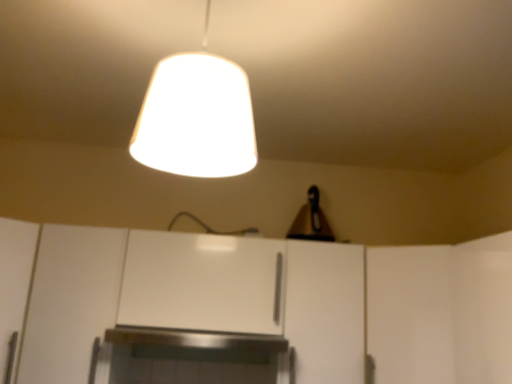
Question: From a real-world perspective, is white matte cabinet at lower left, placed as the 1th cabinetry when sorted from left to right, on top of white matte lampshade at upper center?

Choices:
 (A) no
 (B) yes

Answer: (A)

Question: From the image's perspective, would you say white matte cabinet at lower left, which is counted as the 3th cabinetry, starting from the right, is shown under white matte lampshade at upper center?

Choices:
 (A) yes
 (B) no

Answer: (A)

Question: Considering the relative positions of white matte cabinet at lower left, which is counted as the 3th cabinetry, starting from the right, and white matte lampshade at upper center in the image provided, is white matte cabinet at lower left, which is counted as the 3th cabinetry, starting from the right, to the right of white matte lampshade at upper center from the viewer's perspective?

Choices:
 (A) yes
 (B) no

Answer: (B)

Question: Considering the relative sizes of white matte cabinet at lower left, placed as the 1th cabinetry when sorted from left to right, and white matte lampshade at upper center in the image provided, is white matte cabinet at lower left, placed as the 1th cabinetry when sorted from left to right, smaller than white matte lampshade at upper center?

Choices:
 (A) yes
 (B) no

Answer: (B)

Question: Can you confirm if white matte cabinet at lower left, placed as the 1th cabinetry when sorted from left to right, is positioned to the left of white matte lampshade at upper center?

Choices:
 (A) no
 (B) yes

Answer: (B)

Question: Is white matte cabinet at center, which ranks as the third cabinetry in left-to-right order, in front of or behind white matte door at right in the image?

Choices:
 (A) behind
 (B) front

Answer: (A)

Question: Based on their positions, is white matte cabinet at center, which is counted as the first cabinetry, starting from the right, located to the left or right of white matte door at right?

Choices:
 (A) left
 (B) right

Answer: (A)

Question: From a real-world perspective, is white matte cabinet at center, which is counted as the first cabinetry, starting from the right, positioned above or below white matte door at right?

Choices:
 (A) above
 (B) below

Answer: (B)

Question: In terms of height, does white matte cabinet at center, which is counted as the first cabinetry, starting from the right, look taller or shorter compared to white matte door at right?

Choices:
 (A) short
 (B) tall

Answer: (B)

Question: From the image's perspective, relative to white matte lampshade at upper center, is white matte cabinet at center, which ranks as the 2th cabinetry in right-to-left order, above or below?

Choices:
 (A) below
 (B) above

Answer: (A)

Question: Is white matte cabinet at center, which ranks as the 2th cabinetry in right-to-left order, to the left or to the right of white matte lampshade at upper center in the image?

Choices:
 (A) right
 (B) left

Answer: (B)

Question: Is white matte cabinet at center, which ranks as the 2th cabinetry in right-to-left order, bigger or smaller than white matte lampshade at upper center?

Choices:
 (A) big
 (B) small

Answer: (A)

Question: Relative to white matte lampshade at upper center, is white matte cabinet at center, which ranks as the 2th cabinetry in right-to-left order, in front or behind?

Choices:
 (A) behind
 (B) front

Answer: (A)

Question: From a real-world perspective, is white matte cabinet at center, which is counted as the first cabinetry, starting from the right, physically located above or below white matte cabinet at lower left, which is counted as the 3th cabinetry, starting from the right?

Choices:
 (A) below
 (B) above

Answer: (B)

Question: Is white matte cabinet at center, which ranks as the third cabinetry in left-to-right order, wider or thinner than white matte cabinet at lower left, which is counted as the 3th cabinetry, starting from the right?

Choices:
 (A) thin
 (B) wide

Answer: (B)